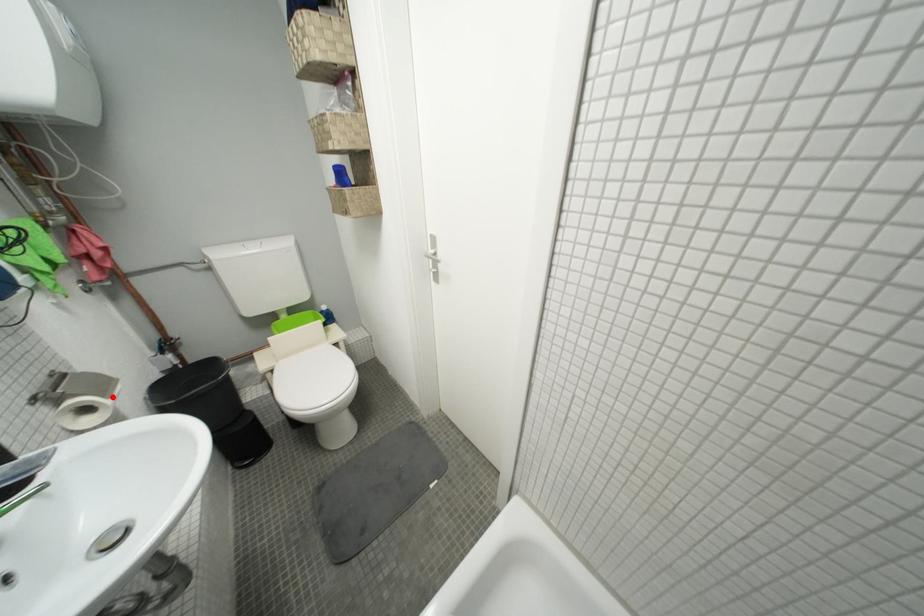
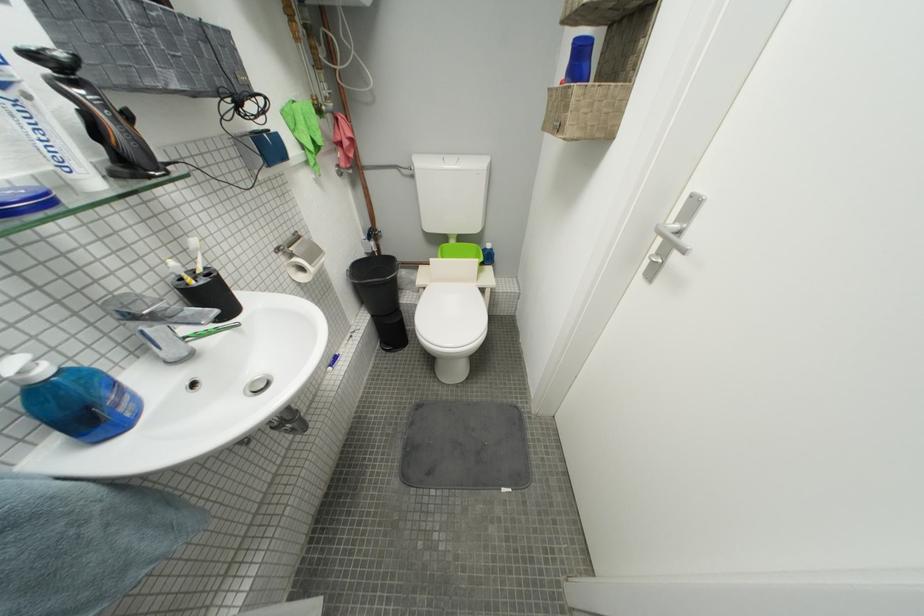
Locate, in the second image, the point that corresponds to the highlighted location in the first image.

(320, 265)